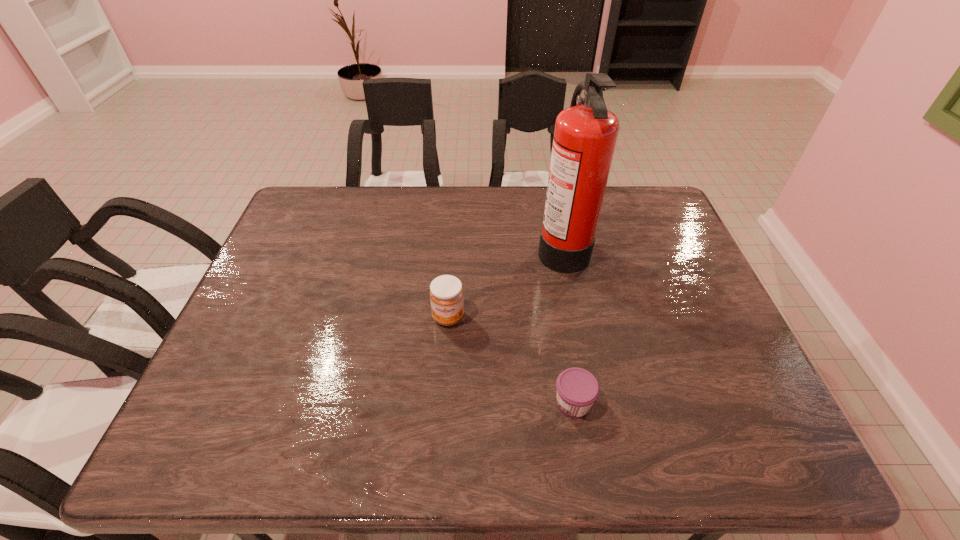
Identify the location of free region located on the front label of the right jam. (418, 403).

I want to click on free point located on the front label of the right jam, so click(x=445, y=403).

At what (x,y) coordinates should I click in order to perform the action: click on free location located 0.080m on the front label of the right jam. Please return your answer as a coordinate pair (x, y). The height and width of the screenshot is (540, 960). Looking at the image, I should click on (516, 403).

Image resolution: width=960 pixels, height=540 pixels. Find the location of `object at the far edge`. object at the far edge is located at coordinates (585, 135).

This screenshot has width=960, height=540. I want to click on object at the near edge, so click(577, 389).

In the image, there is a desktop. Where is `vacant space at the far edge`? The width and height of the screenshot is (960, 540). vacant space at the far edge is located at coordinates (436, 222).

At what (x,y) coordinates should I click in order to perform the action: click on vacant space at the near edge. Please return your answer as a coordinate pair (x, y). This screenshot has width=960, height=540. Looking at the image, I should click on (319, 464).

Where is `vacant region at the left edge`? The image size is (960, 540). vacant region at the left edge is located at coordinates (273, 393).

You are a GUI agent. You are given a task and a screenshot of the screen. Output one action in this format:
    pyautogui.click(x=<x>, y=<y>)
    Task: Click on the vacant space at the right edge
    
    Given the screenshot: What is the action you would take?
    pyautogui.click(x=663, y=333)

Find the location of a particular element. free space at the far right corner of the desktop is located at coordinates (658, 213).